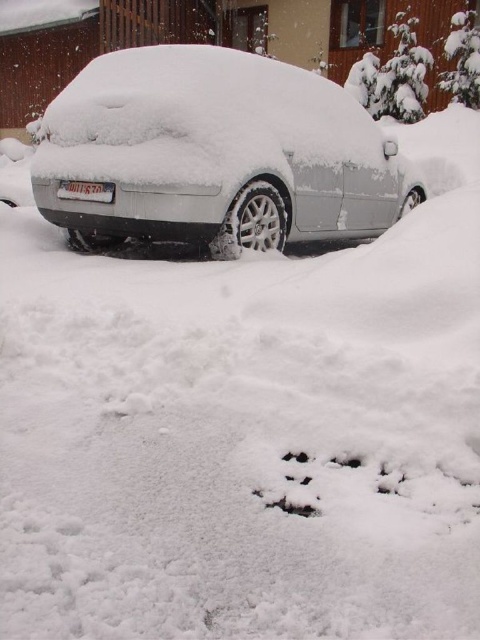
Can you confirm if white matte car at center is positioned to the left of white plastic license plate at center?

No, white matte car at center is not to the left of white plastic license plate at center.

Between white matte car at center and white plastic license plate at center, which one is positioned higher?

white matte car at center

The width and height of the screenshot is (480, 640). I want to click on white matte car at center, so click(216, 152).

Find the location of a particular element. The width and height of the screenshot is (480, 640). white matte car at center is located at coordinates (216, 152).